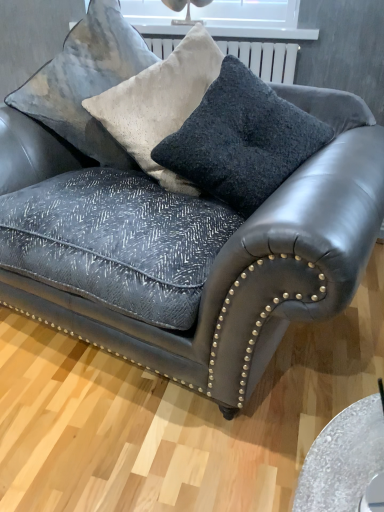
Question: Which direction should I rotate to face velvet textured pillow at upper center, the first throw pillow from the left, — up or down?

Choices:
 (A) up
 (B) down

Answer: (A)

Question: Can you confirm if dark gray textured cushion at center, arranged as the 2th throw pillow when viewed from the left, is shorter than velvet textured pillow at upper center, the first throw pillow from the left?

Choices:
 (A) no
 (B) yes

Answer: (B)

Question: Is dark gray textured cushion at center, arranged as the 2th throw pillow when viewed from the left, taller than velvet textured pillow at upper center, the first throw pillow from the left?

Choices:
 (A) yes
 (B) no

Answer: (B)

Question: From the image's perspective, is dark gray textured cushion at center, the first throw pillow in the right-to-left sequence, located beneath velvet textured pillow at upper center, placed as the second throw pillow when sorted from right to left?

Choices:
 (A) no
 (B) yes

Answer: (B)

Question: From the image's perspective, is dark gray textured cushion at center, the first throw pillow in the right-to-left sequence, above velvet textured pillow at upper center, placed as the second throw pillow when sorted from right to left?

Choices:
 (A) no
 (B) yes

Answer: (A)

Question: Is dark gray textured cushion at center, arranged as the 2th throw pillow when viewed from the left, located outside velvet textured pillow at upper center, the first throw pillow from the left?

Choices:
 (A) no
 (B) yes

Answer: (A)

Question: Does dark gray textured cushion at center, the first throw pillow in the right-to-left sequence, come in front of velvet textured pillow at upper center, placed as the second throw pillow when sorted from right to left?

Choices:
 (A) yes
 (B) no

Answer: (A)

Question: Is velvet cushion at upper center inside dark gray textured cushion at center, arranged as the 2th throw pillow when viewed from the left?

Choices:
 (A) yes
 (B) no

Answer: (B)

Question: Does dark gray textured cushion at center, arranged as the 2th throw pillow when viewed from the left, have a lesser width compared to velvet cushion at upper center?

Choices:
 (A) no
 (B) yes

Answer: (B)

Question: Is dark gray textured cushion at center, the first throw pillow in the right-to-left sequence, turned away from velvet cushion at upper center?

Choices:
 (A) no
 (B) yes

Answer: (A)

Question: From a real-world perspective, is dark gray textured cushion at center, the first throw pillow in the right-to-left sequence, located beneath velvet cushion at upper center?

Choices:
 (A) yes
 (B) no

Answer: (A)

Question: From a real-world perspective, is dark gray textured cushion at center, arranged as the 2th throw pillow when viewed from the left, on top of velvet cushion at upper center?

Choices:
 (A) yes
 (B) no

Answer: (B)

Question: Does dark gray textured cushion at center, arranged as the 2th throw pillow when viewed from the left, appear on the left side of velvet cushion at upper center?

Choices:
 (A) yes
 (B) no

Answer: (B)

Question: Is velvet cushion at upper center closer to the viewer compared to velvet textured pillow at upper center, the first throw pillow from the left?

Choices:
 (A) no
 (B) yes

Answer: (A)